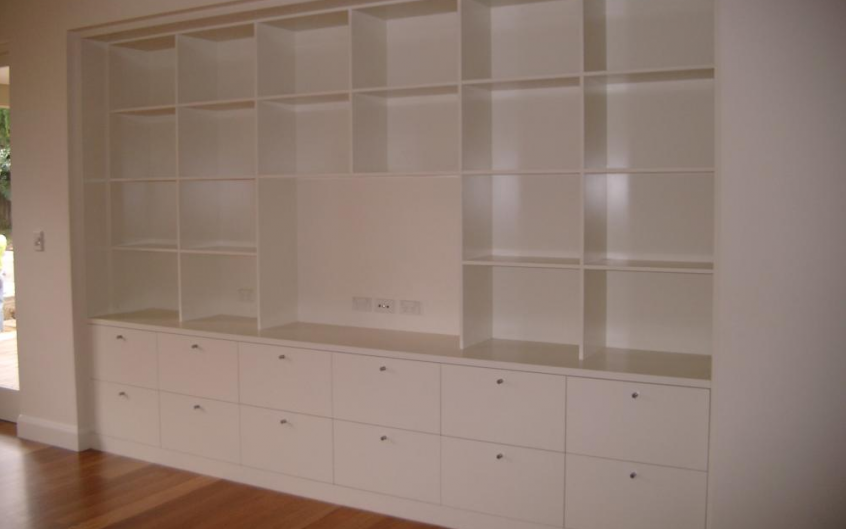
Identify the location of top drawers. This screenshot has width=846, height=529. (138, 363), (191, 369), (299, 389), (361, 401), (547, 424), (623, 426).